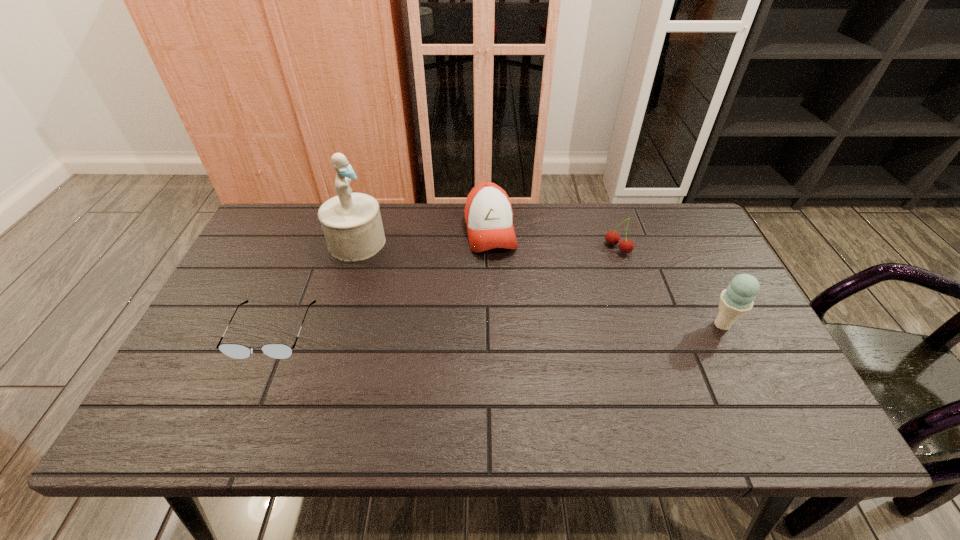
The width and height of the screenshot is (960, 540). I want to click on vacant area located 0.330m on the front-facing side of the third object from right to left, so click(x=516, y=350).

Image resolution: width=960 pixels, height=540 pixels. Identify the location of vacant region located 0.290m at the beak of the figurine. (451, 298).

Identify the location of blank space located 0.320m at the beak of the figurine. (460, 302).

The height and width of the screenshot is (540, 960). What are the coordinates of `free space located 0.060m at the beak of the figurine` in the screenshot? It's located at (391, 262).

I want to click on free region located 0.110m on the surface of the cherry, so click(x=583, y=269).

Locate an element on the screen. This screenshot has width=960, height=540. vacant area situated on the surface of the cherry is located at coordinates (578, 272).

The width and height of the screenshot is (960, 540). In order to click on vacant region located on the surface of the cherry in this screenshot , I will do `click(533, 298)`.

Find the location of a particular element. baseball cap that is at the far edge is located at coordinates (488, 212).

Where is `figurine positioned at the far edge`? This screenshot has width=960, height=540. figurine positioned at the far edge is located at coordinates (351, 222).

Find the location of `cherry that is at the far edge`. cherry that is at the far edge is located at coordinates (612, 237).